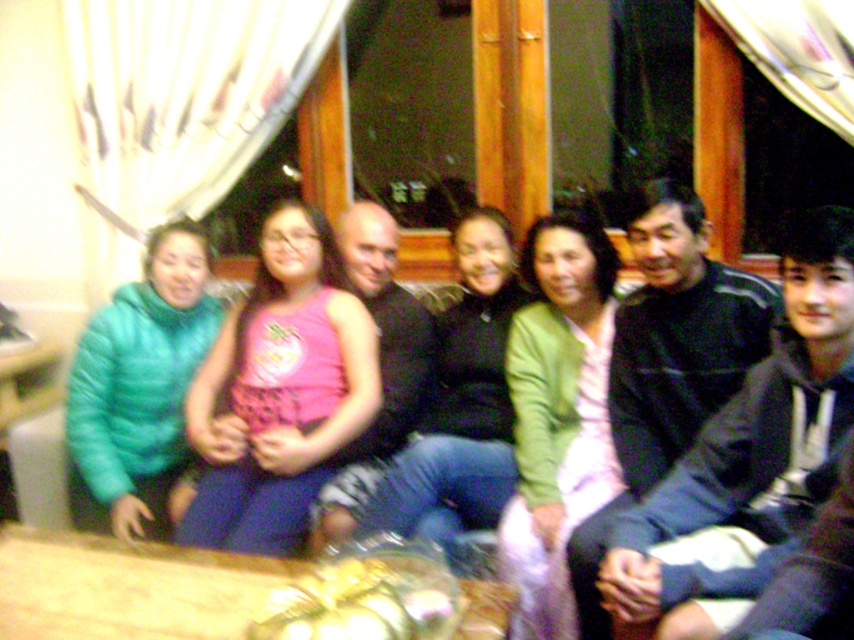
Question: Which point is farther to the camera?

Choices:
 (A) (635, 195)
 (B) (490, 493)
 (C) (490, 609)

Answer: (B)

Question: Which object is the farthest from the wooden table at center?

Choices:
 (A) pink fabric dress at center
 (B) matte black sweater at center
 (C) green matte sweater at center
 (D) matte green jacket at center

Answer: (D)

Question: Does green matte sweater at center appear on the right side of teal puffy jacket at left?

Choices:
 (A) no
 (B) yes

Answer: (B)

Question: Is green matte sweater at center wider than teal puffy jacket at left?

Choices:
 (A) no
 (B) yes

Answer: (A)

Question: Is matte green jacket at center below green matte sweater at center?

Choices:
 (A) no
 (B) yes

Answer: (A)

Question: Which object is the farthest from the matte black sweater at center?

Choices:
 (A) pink fabric dress at center
 (B) green matte sweater at center
 (C) matte green jacket at center

Answer: (C)